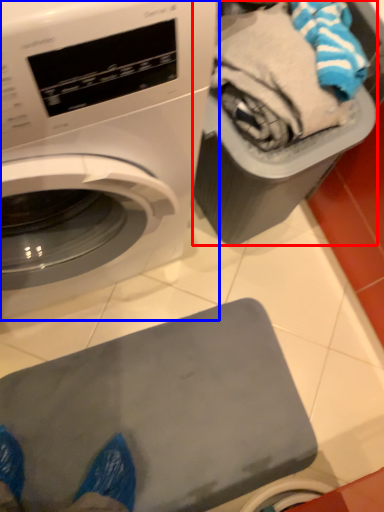
Question: Which of the following is the farthest to the observer, garbage (highlighted by a red box) or washing machine (highlighted by a blue box)?

Choices:
 (A) garbage
 (B) washing machine

Answer: (A)